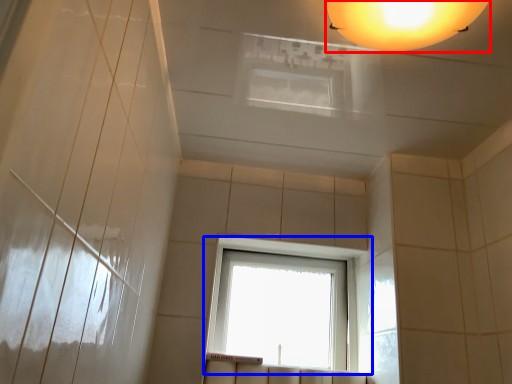
Question: Which object is closer to the camera taking this photo, lamp (highlighted by a red box) or window (highlighted by a blue box)?

Choices:
 (A) lamp
 (B) window

Answer: (A)